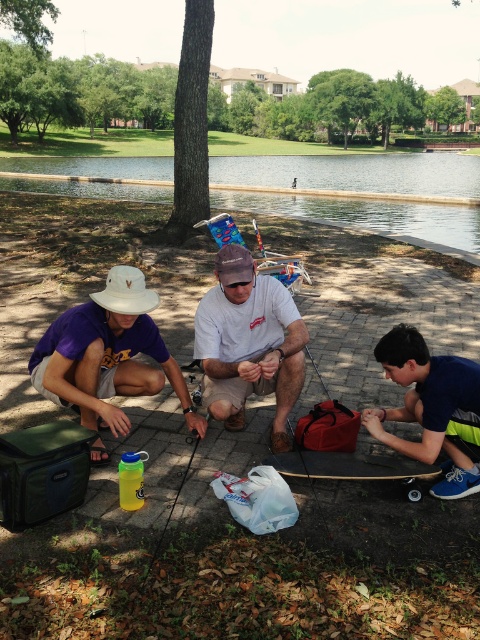
Question: Which object is the closest to the white matte shirt at center?

Choices:
 (A) blue fabric shirt at lower right
 (B) white matte cowboy hat at lower left

Answer: (B)

Question: Which point is farther from the camera taking this photo?

Choices:
 (A) click(x=244, y=333)
 (B) click(x=116, y=291)

Answer: (A)

Question: Among these points, which one is nearest to the camera?

Choices:
 (A) (240, 294)
 (B) (119, 300)
 (C) (49, 349)
 (D) (241, 244)

Answer: (B)

Question: Is white matte shirt at center above matte blue party hat at center?

Choices:
 (A) yes
 (B) no

Answer: (B)

Question: Is purple matte hat at center smaller than white matte cowboy hat at lower left?

Choices:
 (A) no
 (B) yes

Answer: (A)

Question: From the image, what is the correct spatial relationship of blue fabric shirt at lower right in relation to white matte cowboy hat at lower left?

Choices:
 (A) above
 (B) below

Answer: (B)